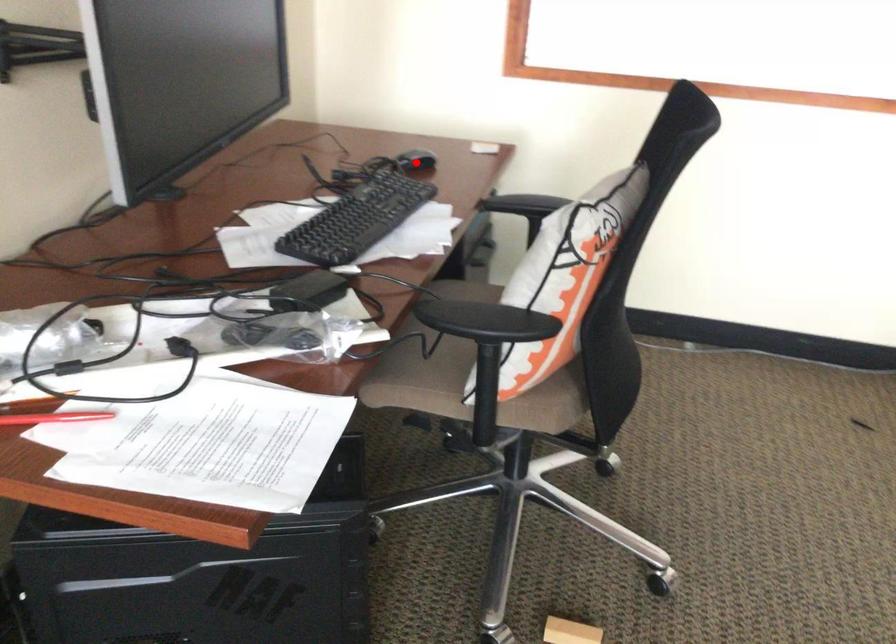
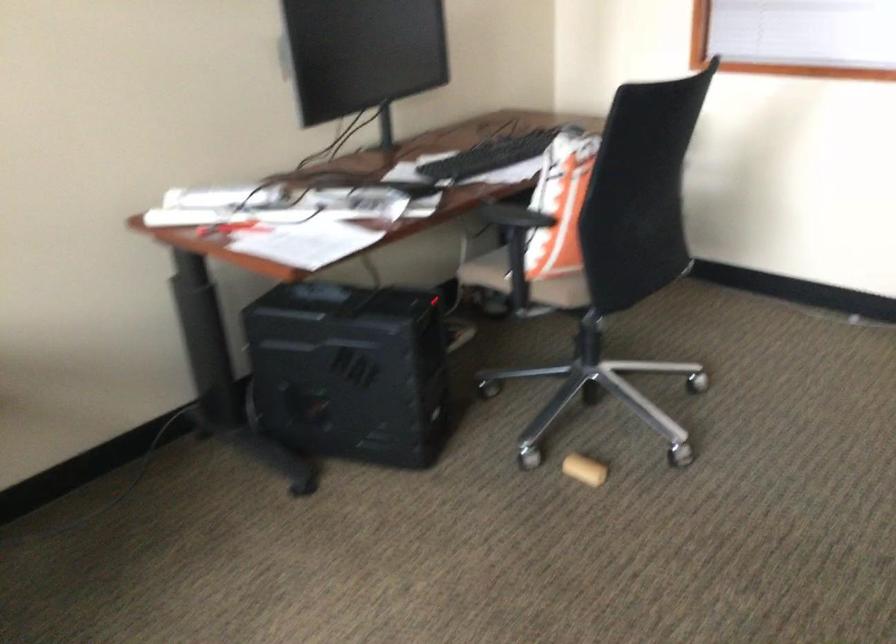
Question: I am providing you with two images of the same scene from different viewpoints. A red point is marked on the first image. Is the red point's position out of view in image 2?

Choices:
 (A) Yes
 (B) No

Answer: (A)